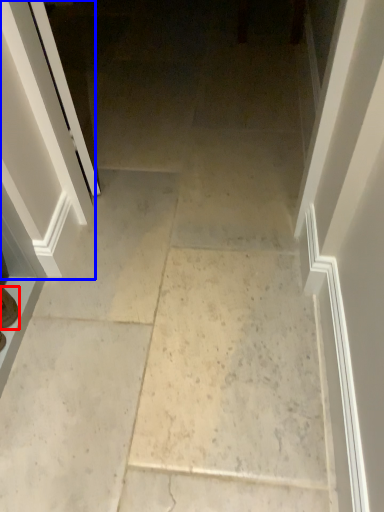
Question: Which object appears closest to the camera in this image, footwear (highlighted by a red box) or screen door (highlighted by a blue box)?

Choices:
 (A) footwear
 (B) screen door

Answer: (B)